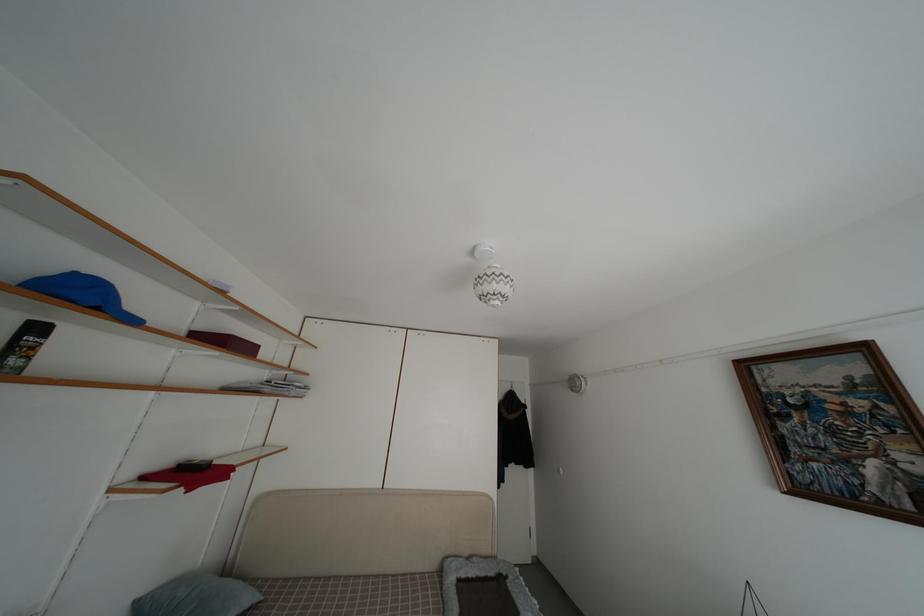
The height and width of the screenshot is (616, 924). I want to click on black spray can, so click(27, 344).